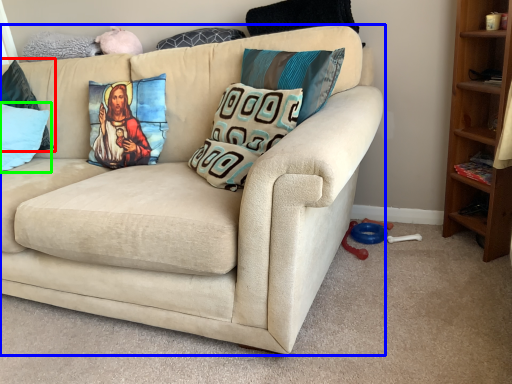
Question: Estimate the real-world distances between objects in this image. Which object is farther from pillow (highlighted by a red box), studio couch (highlighted by a blue box) or pillow (highlighted by a green box)?

Choices:
 (A) studio couch
 (B) pillow

Answer: (A)